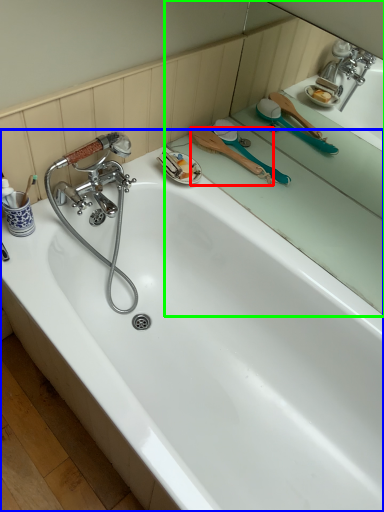
Question: Estimate the real-world distances between objects in this image. Which object is closer to brush (highlighted by a red box), bathtub (highlighted by a blue box) or mirror (highlighted by a green box)?

Choices:
 (A) bathtub
 (B) mirror

Answer: (B)